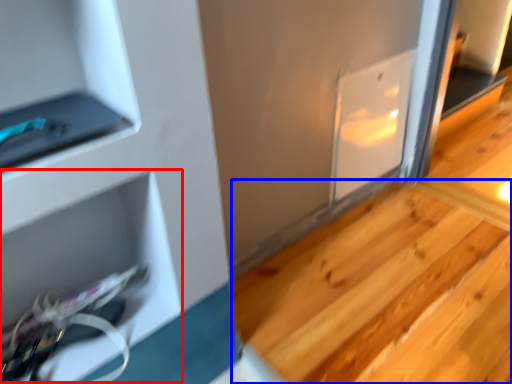
Question: Which of the following is the farthest to the observer, shelf (highlighted by a red box) or stair (highlighted by a blue box)?

Choices:
 (A) shelf
 (B) stair

Answer: (B)